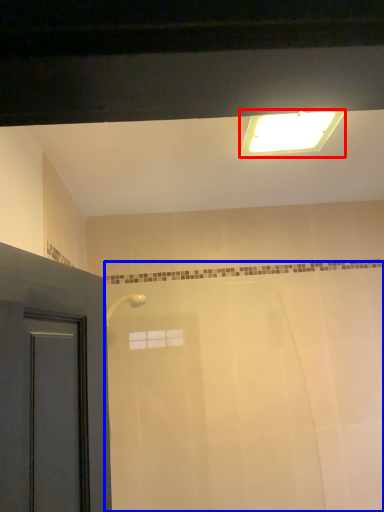
Question: Which of the following is the farthest to the observer, lighting (highlighted by a red box) or bath (highlighted by a blue box)?

Choices:
 (A) lighting
 (B) bath

Answer: (B)